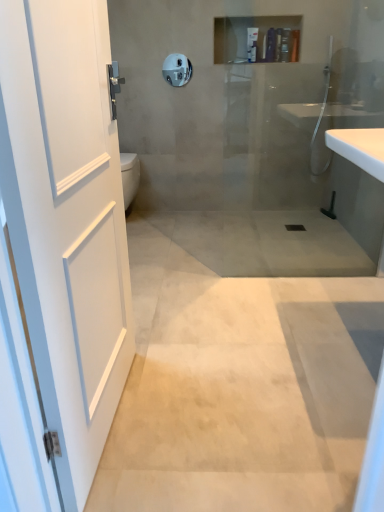
Question: Is matte plastic shampoo bottle at upper center, which is the third toiletry from left to right, to the left or to the right of matte plastic shampoo bottle at upper center, which is the second toiletry from right to left, in the image?

Choices:
 (A) left
 (B) right

Answer: (B)

Question: Do you think matte plastic shampoo bottle at upper center, marked as the first toiletry in a right-to-left arrangement, is within matte plastic shampoo bottle at upper center, positioned as the second toiletry in left-to-right order, or outside of it?

Choices:
 (A) inside
 (B) outside

Answer: (B)

Question: Which object is positioned closest to the beige polished concrete at center?

Choices:
 (A) matte plastic bottle at upper center, the third toiletry in the right-to-left sequence
 (B) white matte door at left
 (C) matte plastic shampoo bottle at upper center, positioned as the second toiletry in left-to-right order
 (D) white glossy toilet bowl at left
 (E) satin nickel towel bar at upper center

Answer: (B)

Question: Based on their relative distances, which object is farther from the satin nickel towel bar at upper center?

Choices:
 (A) matte plastic shampoo bottle at upper center, positioned as the second toiletry in left-to-right order
 (B) white glossy sink at right
 (C) white glossy toilet bowl at left
 (D) matte plastic bottle at upper center, the first toiletry viewed from the left
 (E) white matte door at left

Answer: (E)